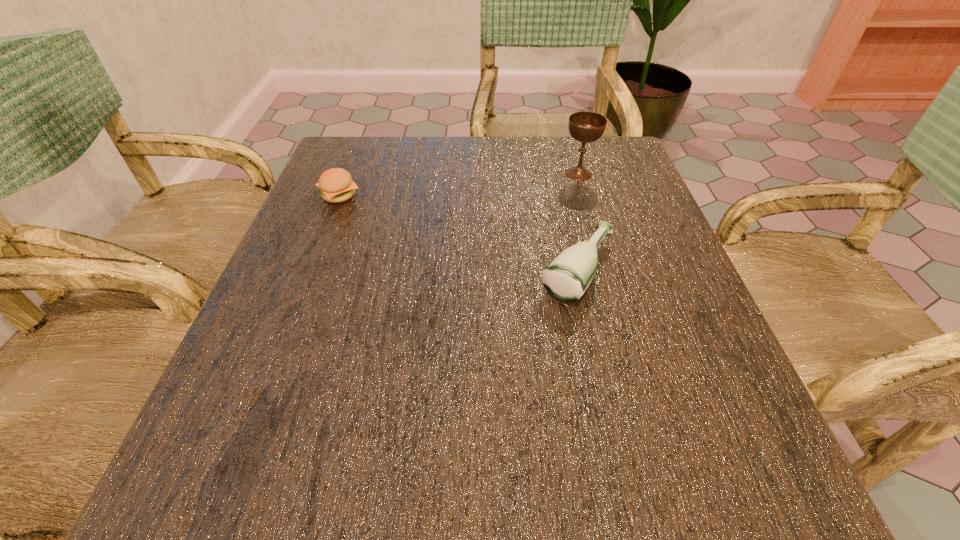
Where is `blank space at the far right corner of the desktop`? Image resolution: width=960 pixels, height=540 pixels. blank space at the far right corner of the desktop is located at coordinates (592, 185).

Identify the location of free spot between the leftmost object and the bottle. pyautogui.click(x=458, y=233).

Find the location of a particular element. The image size is (960, 540). vacant point located between the nearest object and the chalice is located at coordinates (578, 222).

Locate an element on the screen. The image size is (960, 540). vacant area that lies between the hamburger and the tallest object is located at coordinates (459, 185).

Find the location of a particular element. This screenshot has height=540, width=960. free space between the nearest object and the chalice is located at coordinates (578, 222).

You are a GUI agent. You are given a task and a screenshot of the screen. Output one action in this format:
    pyautogui.click(x=<x>, y=<y>)
    Task: Click on the free point between the bottle and the leftmost object
    This screenshot has width=960, height=540.
    Given the screenshot: What is the action you would take?
    pyautogui.click(x=458, y=233)

Locate an element on the screen. The width and height of the screenshot is (960, 540). vacant region between the tallest object and the second shortest object is located at coordinates (578, 222).

Find the location of `free area in between the shortest object and the chalice`. free area in between the shortest object and the chalice is located at coordinates (459, 185).

Image resolution: width=960 pixels, height=540 pixels. Find the location of `unoccupied area between the shortest object and the tallest object`. unoccupied area between the shortest object and the tallest object is located at coordinates (459, 185).

The height and width of the screenshot is (540, 960). What are the coordinates of `free point between the second shortest object and the shortest object` in the screenshot? It's located at (458, 233).